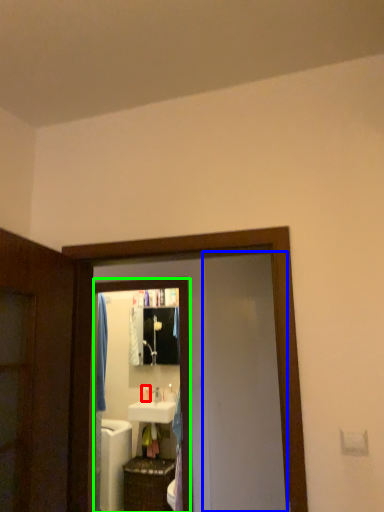
Question: Which is nearer to the toiletry (highlighted by a red box)? screen door (highlighted by a blue box) or mirror (highlighted by a green box).

Choices:
 (A) screen door
 (B) mirror

Answer: (B)